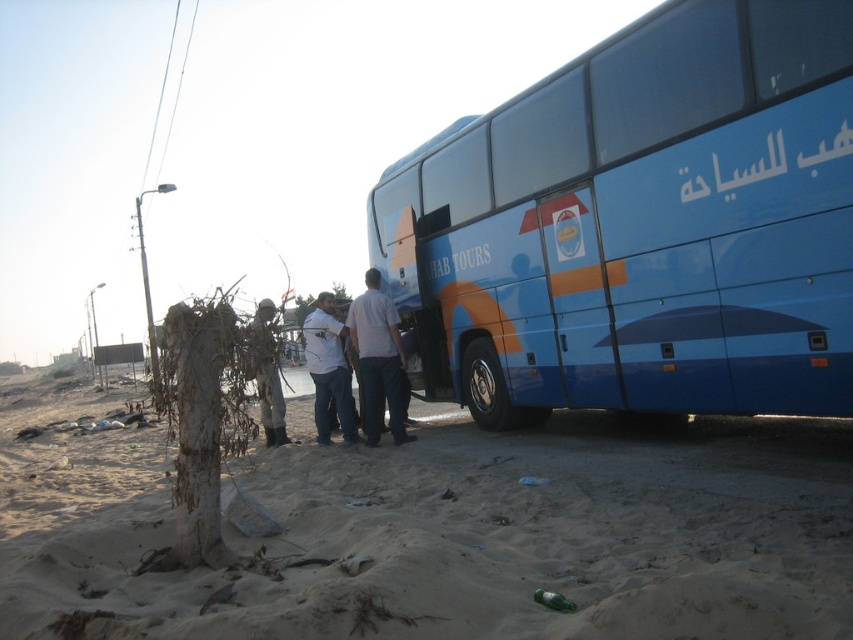
Question: Does white cotton shirt at center have a larger size compared to white matte shirt at center?

Choices:
 (A) yes
 (B) no

Answer: (B)

Question: Among these objects, which one is farthest from the camera?

Choices:
 (A) white matte shirt at center
 (B) sandy textured sand at lower left
 (C) blue glossy bus at right

Answer: (A)

Question: Is sandy textured sand at lower left below blue glossy bus at right?

Choices:
 (A) yes
 (B) no

Answer: (A)

Question: Which of the following is the farthest from the observer?

Choices:
 (A) (756, 620)
 (B) (320, 392)
 (C) (583, 358)

Answer: (B)

Question: From the image, what is the correct spatial relationship of white cotton shirt at center in relation to white matte shirt at center?

Choices:
 (A) above
 (B) below

Answer: (A)

Question: Which point is farther to the camera?

Choices:
 (A) white cotton shirt at center
 (B) white matte shirt at center
 (C) camouflage fabric figure at center
 (D) blue glossy bus at right

Answer: (A)